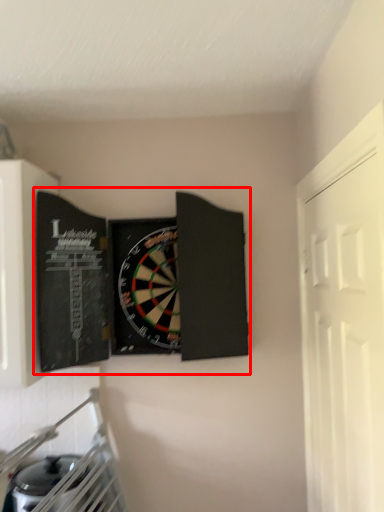
Question: In this image, where is book (annotated by the red box) located relative to door?

Choices:
 (A) left
 (B) right

Answer: (A)